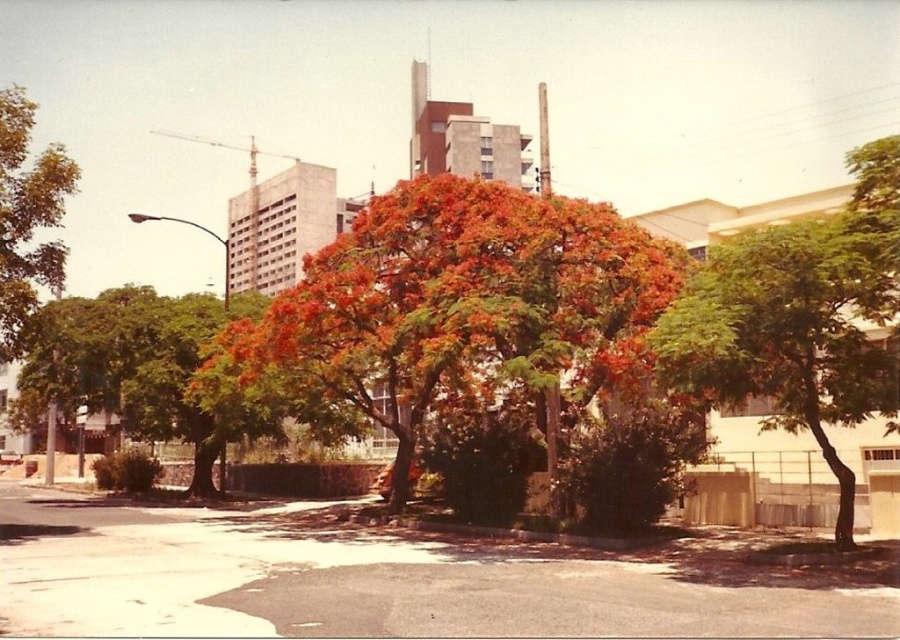
Is green leafy tree at center behind green leafy tree at left?

No, it is not.

Which is more to the right, green leafy tree at center or green leafy tree at left?

Positioned to the right is green leafy tree at center.

Who is more distant from viewer, (832, 339) or (54, 289)?

Point (54, 289)

The width and height of the screenshot is (900, 640). In order to click on green leafy tree at center in this screenshot , I will do `click(801, 320)`.

Is the position of orange leafy tree at center less distant than that of green leafy tree at center?

No.

Between orange leafy tree at center and green leafy tree at center, which one is positioned lower?

Positioned lower is orange leafy tree at center.

The height and width of the screenshot is (640, 900). I want to click on orange leafy tree at center, so click(x=450, y=308).

Does orange leafy tree at center appear over green leafy tree at left?

No.

Is orange leafy tree at center wider than green leafy tree at left?

In fact, orange leafy tree at center might be narrower than green leafy tree at left.

Consider the image. Who is more distant from viewer, (364, 365) or (34, 285)?

Point (364, 365)

Where is `orange leafy tree at center`? orange leafy tree at center is located at coordinates (450, 308).